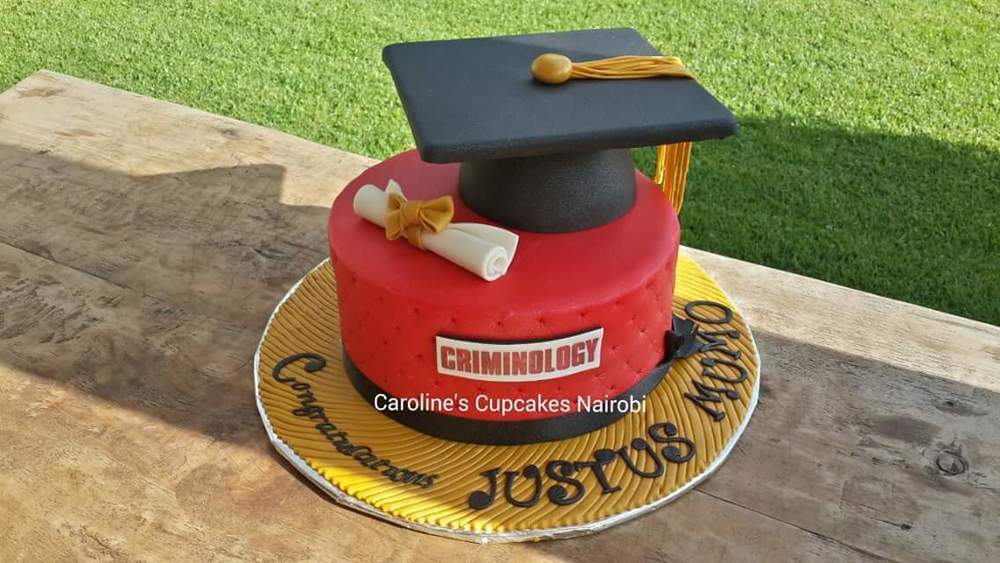
In order to click on yellow fondon decoration in this screenshot , I will do `click(434, 482)`.